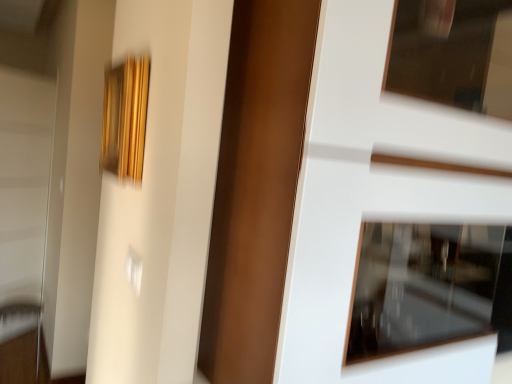
Question: Would you say gold textured frame at upper left is outside white glossy screen door at left?

Choices:
 (A) no
 (B) yes

Answer: (B)

Question: Are gold textured frame at upper left and white glossy screen door at left beside each other?

Choices:
 (A) no
 (B) yes

Answer: (A)

Question: Does gold textured frame at upper left appear on the left side of white glossy screen door at left?

Choices:
 (A) no
 (B) yes

Answer: (A)

Question: Is the depth of gold textured frame at upper left greater than that of white glossy screen door at left?

Choices:
 (A) no
 (B) yes

Answer: (A)

Question: From a real-world perspective, is gold textured frame at upper left on top of white glossy screen door at left?

Choices:
 (A) no
 (B) yes

Answer: (B)

Question: Is gold textured frame at upper left not near white glossy screen door at left?

Choices:
 (A) no
 (B) yes

Answer: (B)

Question: Is metallic silver door handle at lower left at the right side of white glossy screen door at left?

Choices:
 (A) no
 (B) yes

Answer: (B)

Question: From a real-world perspective, is metallic silver door handle at lower left positioned over white glossy screen door at left based on gravity?

Choices:
 (A) yes
 (B) no

Answer: (B)

Question: Is white glossy screen door at left surrounded by metallic silver door handle at lower left?

Choices:
 (A) no
 (B) yes

Answer: (A)

Question: Can you confirm if metallic silver door handle at lower left is bigger than white glossy screen door at left?

Choices:
 (A) yes
 (B) no

Answer: (B)

Question: Could you tell me if metallic silver door handle at lower left is facing white glossy screen door at left?

Choices:
 (A) no
 (B) yes

Answer: (A)

Question: Is metallic silver door handle at lower left touching white glossy screen door at left?

Choices:
 (A) yes
 (B) no

Answer: (B)

Question: Is white glossy door at center placed right next to white glossy screen door at left?

Choices:
 (A) no
 (B) yes

Answer: (A)